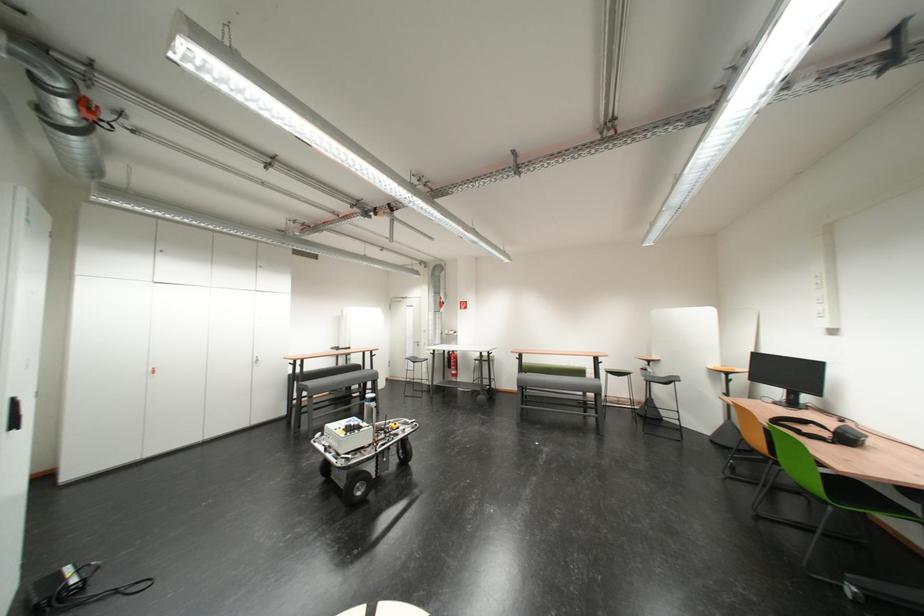
Identify the location of grey sofa sitting surface. This screenshot has height=616, width=924. (337, 381).